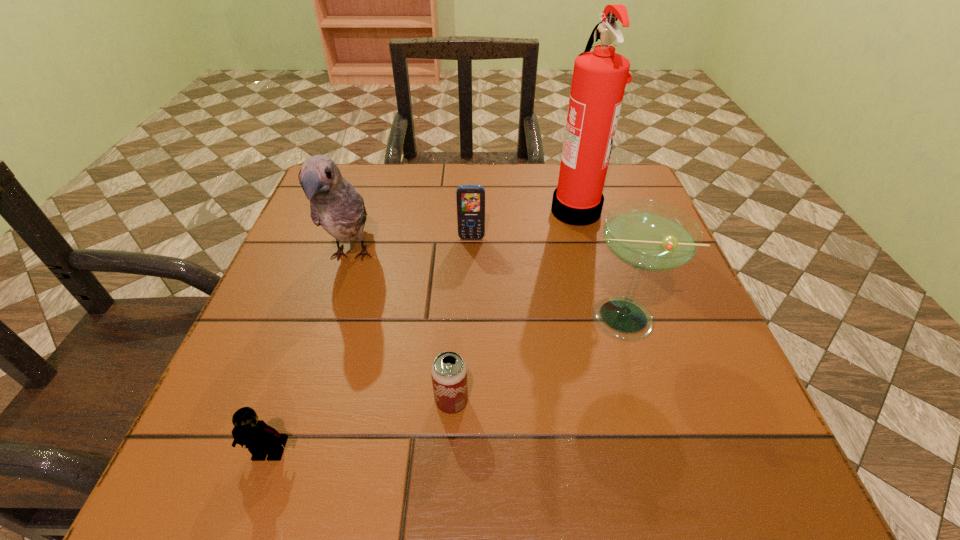
Where is `vacant space that satisfies the following two spatial constraints: 1. with the nozzle aimed from the fire extinguisher; 2. on the back side of the martini`? vacant space that satisfies the following two spatial constraints: 1. with the nozzle aimed from the fire extinguisher; 2. on the back side of the martini is located at coordinates (604, 318).